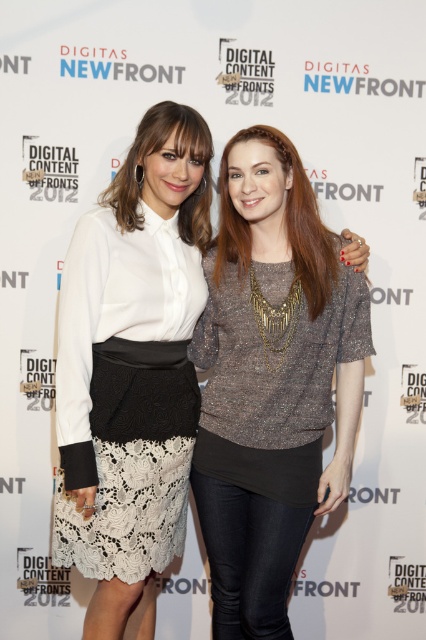
You are a photographer standing at the event. You want to take a closeup shot of the sparkly metallic top at center. What is the minimum distance you need to be from the top to capture it clearly?

The minimum distance you need to be from the sparkly metallic top at center is 1.70 meters to capture it clearly.

Based on the scene description, where is the sparkly metallic top at center located in the image?

The sparkly metallic top at center is located at the 2D coordinates point (270, 381) in the image.

You are a photographer at the event and need to ensure both the sparkly metallic top at center and the white lace skirt at center are clearly visible in the photo. Given their current positions, can you adjust the camera angle so both are fully visible without one blocking the other?

The white lace skirt at center is behind the sparkly metallic top at center, so adjusting the camera angle to capture both would require moving the camera position to either side so that the skirt is no longer obscured by the top.